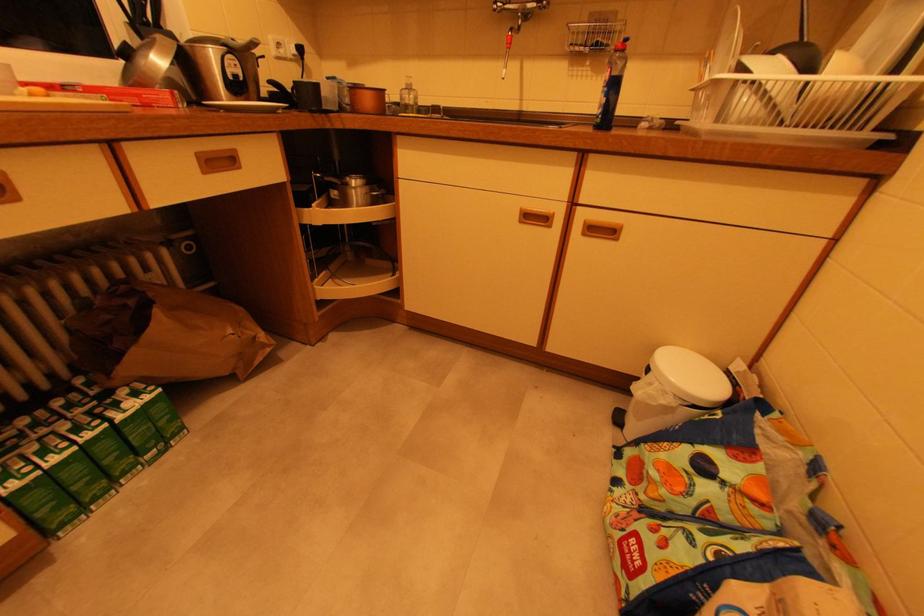
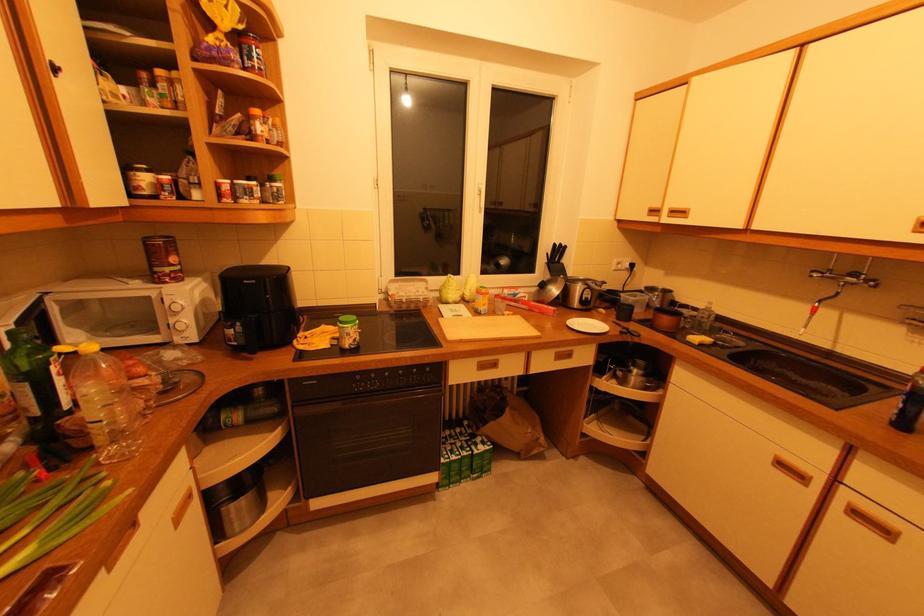
Find the pixel in the second image that matches (609,98) in the first image.

(907, 403)